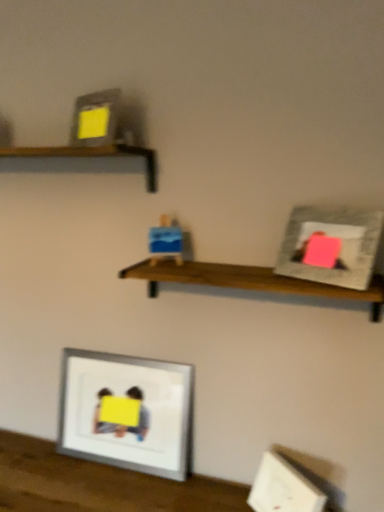
Where is `vacant point above wooden shelf at center, which is counted as the first shelf, starting from the right (from a real-world perspective)`? This screenshot has width=384, height=512. vacant point above wooden shelf at center, which is counted as the first shelf, starting from the right (from a real-world perspective) is located at coordinates (238, 273).